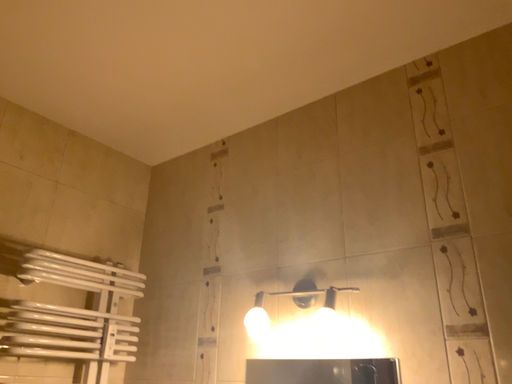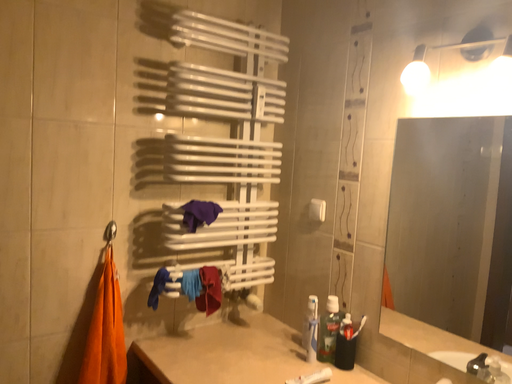
Question: How did the camera likely rotate when shooting the video?

Choices:
 (A) rotated upward
 (B) rotated downward

Answer: (B)